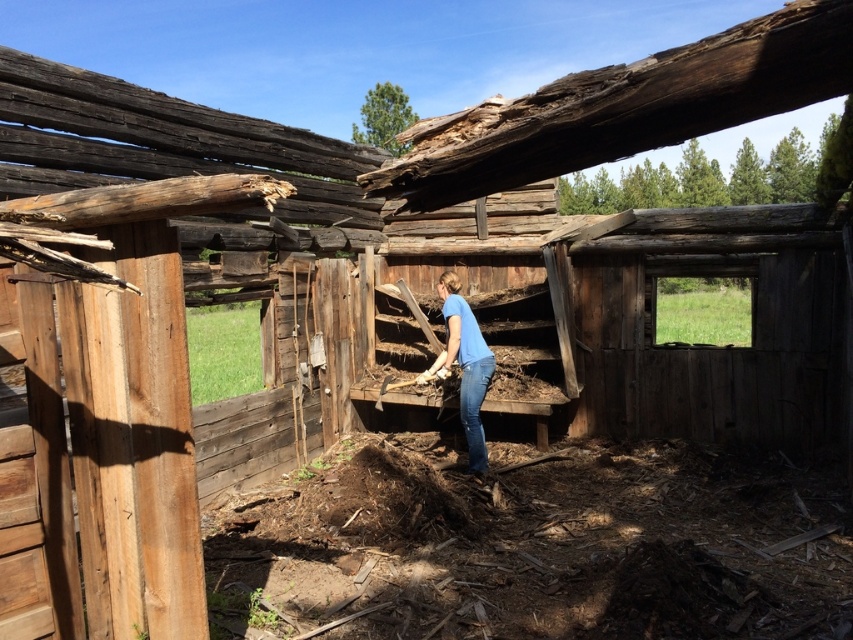
Question: Which object appears closest to the camera in this image?

Choices:
 (A) blue cotton shirt at center
 (B) blue denim jeans at center

Answer: (A)

Question: Can you confirm if blue cotton shirt at center is smaller than blue denim jeans at center?

Choices:
 (A) yes
 (B) no

Answer: (B)

Question: Where is blue cotton shirt at center located in relation to blue denim jeans at center in the image?

Choices:
 (A) above
 (B) below

Answer: (A)

Question: Among these objects, which one is nearest to the camera?

Choices:
 (A) blue cotton shirt at center
 (B) blue denim jeans at center

Answer: (A)

Question: Does blue cotton shirt at center have a greater width compared to blue denim jeans at center?

Choices:
 (A) yes
 (B) no

Answer: (A)

Question: Which object appears closest to the camera in this image?

Choices:
 (A) blue denim jeans at center
 (B) blue cotton shirt at center

Answer: (B)